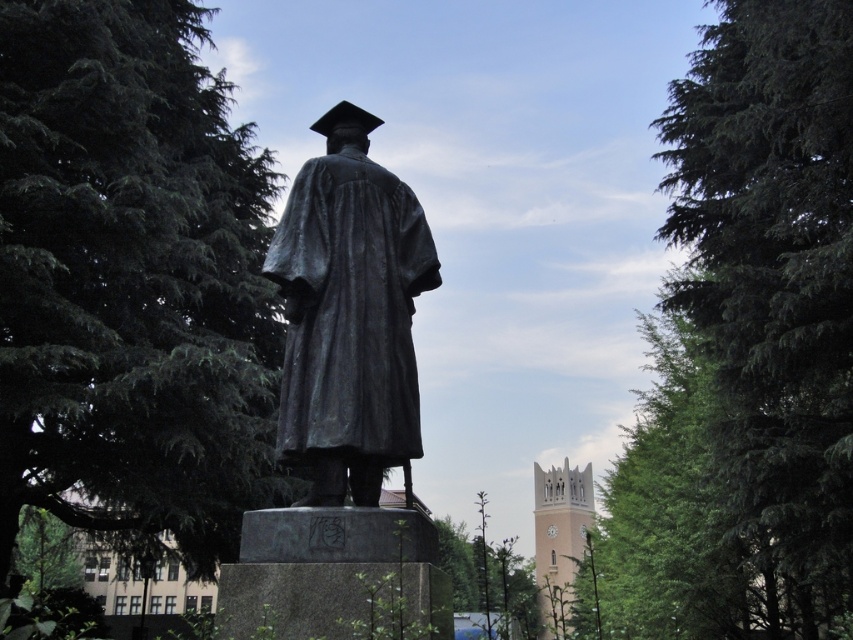
Question: Which object appears farthest from the camera in this image?

Choices:
 (A) green textured tree at right
 (B) green textured leaves at upper left

Answer: (B)

Question: Is the position of green textured leaves at upper left more distant than that of bronze/textured statue at center?

Choices:
 (A) yes
 (B) no

Answer: (A)

Question: Which object is closer to the camera taking this photo?

Choices:
 (A) green textured leaves at upper left
 (B) green textured tree at right

Answer: (B)

Question: Does green textured leaves at upper left lie behind green textured tree at right?

Choices:
 (A) no
 (B) yes

Answer: (B)

Question: Which of the following is the closest to the observer?

Choices:
 (A) (210, 292)
 (B) (334, 403)

Answer: (B)

Question: Can you confirm if green textured leaves at upper left is positioned above green textured tree at right?

Choices:
 (A) no
 (B) yes

Answer: (B)